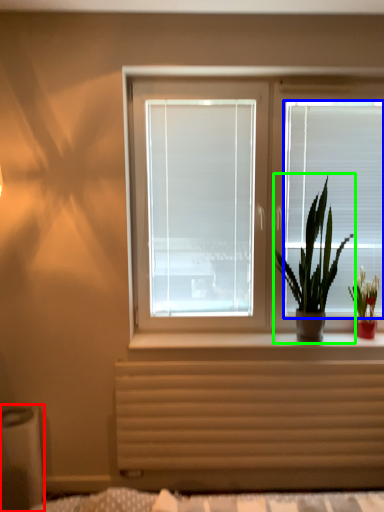
Question: Estimate the real-world distances between objects in this image. Which object is farther from window box (highlighted by a red box), blind (highlighted by a blue box) or houseplant (highlighted by a green box)?

Choices:
 (A) blind
 (B) houseplant

Answer: (A)